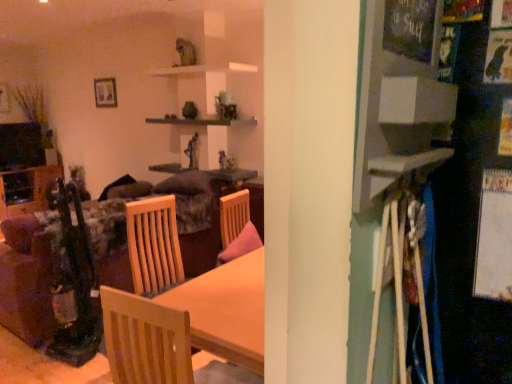
Question: Is velvet floral couch at left inside the boundaries of wooden table at center, or outside?

Choices:
 (A) outside
 (B) inside

Answer: (A)

Question: In terms of width, does velvet floral couch at left look wider or thinner when compared to wooden table at center?

Choices:
 (A) thin
 (B) wide

Answer: (B)

Question: Based on their relative distances, which object is nearer to the wooden table at center?

Choices:
 (A) wooden shelf at left
 (B) velvet floral couch at left
 (C) light wood chair at center
 (D) wooden picture frame at upper left

Answer: (D)

Question: Which object is the closest to the wooden shelf at left?

Choices:
 (A) velvet floral couch at left
 (B) wooden picture frame at upper left
 (C) light wood chair at center
 (D) wooden table at center

Answer: (B)